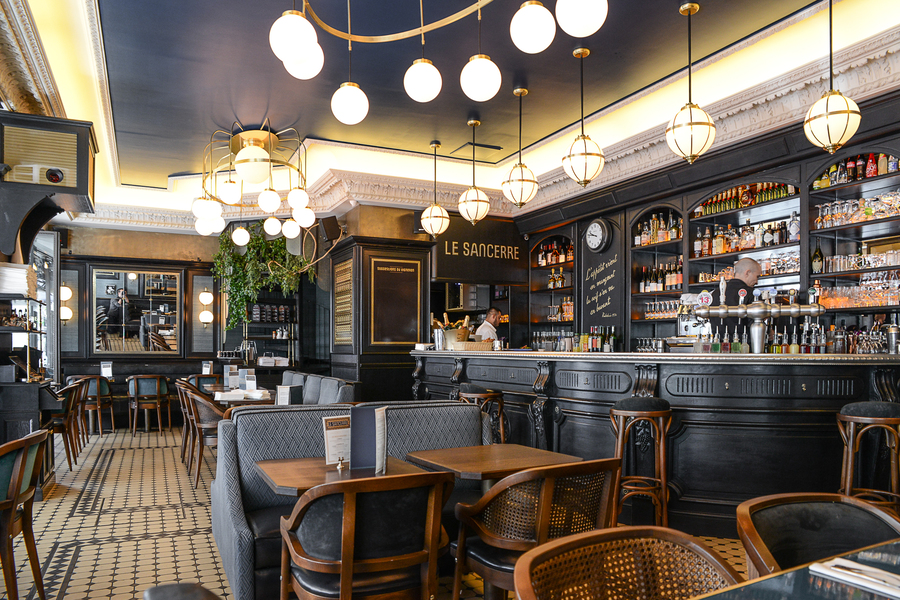
Where is `booze sections counter`? The height and width of the screenshot is (600, 900). booze sections counter is located at coordinates [587, 343], [724, 339], [808, 343], [866, 345].